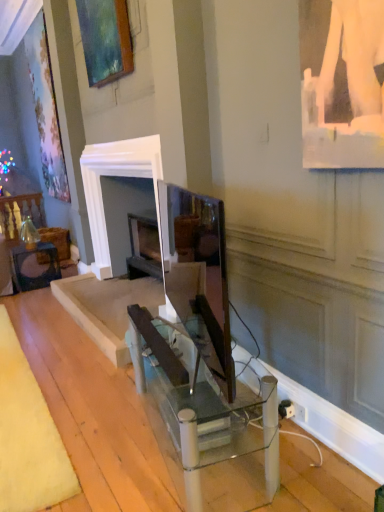
Question: Is matte glass table at lower left, which is the 1th table from back to front, positioned far away from clear glass table at center, which appears as the 2th table when viewed from the back?

Choices:
 (A) no
 (B) yes

Answer: (B)

Question: From a real-world perspective, is matte glass table at lower left, the 2th table from the right, below clear glass table at center, which ranks as the first table in bottom-to-top order?

Choices:
 (A) no
 (B) yes

Answer: (B)

Question: Does matte glass table at lower left, the first table viewed from the top, have a lesser height compared to clear glass table at center, which appears as the 2th table when viewed from the back?

Choices:
 (A) no
 (B) yes

Answer: (B)

Question: Is matte glass table at lower left, the first table viewed from the top, completely or partially outside of clear glass table at center, the second table viewed from the top?

Choices:
 (A) yes
 (B) no

Answer: (A)

Question: Is matte glass table at lower left, acting as the 1th table starting from the left, at the right side of clear glass table at center, acting as the first table starting from the right?

Choices:
 (A) yes
 (B) no

Answer: (B)

Question: Would you say matte glass table at lower left, the first table viewed from the top, is inside or outside clear glass table at center, the second table viewed from the top?

Choices:
 (A) outside
 (B) inside

Answer: (A)

Question: Does point (34, 268) appear closer or farther from the camera than point (236, 430)?

Choices:
 (A) farther
 (B) closer

Answer: (A)

Question: Is matte glass table at lower left, which ranks as the second table in bottom-to-top order, taller or shorter than clear glass table at center, acting as the first table starting from the right?

Choices:
 (A) short
 (B) tall

Answer: (A)

Question: Looking at their shapes, would you say matte glass table at lower left, acting as the 1th table starting from the left, is wider or thinner than clear glass table at center, the 1th table viewed from the front?

Choices:
 (A) thin
 (B) wide

Answer: (B)

Question: Looking at their shapes, would you say matte black monitor at center is wider or thinner than matte wooden picture frame at upper left?

Choices:
 (A) thin
 (B) wide

Answer: (B)

Question: Considering the positions of matte black monitor at center and matte wooden picture frame at upper left in the image, is matte black monitor at center taller or shorter than matte wooden picture frame at upper left?

Choices:
 (A) short
 (B) tall

Answer: (A)

Question: Which is correct: matte black monitor at center is inside matte wooden picture frame at upper left, or outside of it?

Choices:
 (A) inside
 (B) outside

Answer: (B)

Question: Is matte black monitor at center in front of or behind matte wooden picture frame at upper left in the image?

Choices:
 (A) behind
 (B) front

Answer: (B)

Question: From their relative heights in the image, would you say matte glass table at lower left, the first table viewed from the top, is taller or shorter than matte wooden picture frame at upper left?

Choices:
 (A) short
 (B) tall

Answer: (A)

Question: Is matte glass table at lower left, the 2th table from the right, situated inside matte wooden picture frame at upper left or outside?

Choices:
 (A) outside
 (B) inside

Answer: (A)